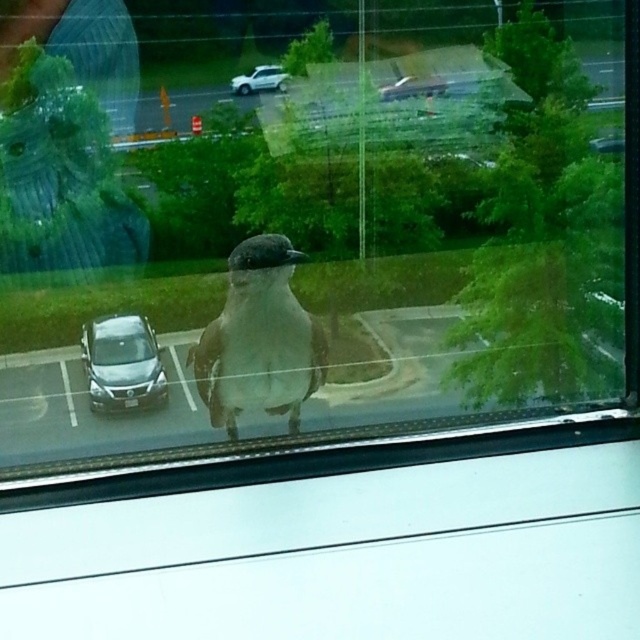
Question: Among these objects, which one is nearest to the camera?

Choices:
 (A) white matte car at center
 (B) satin silver car at lower left
 (C) gray matte bird at center

Answer: (C)

Question: From the image, what is the correct spatial relationship of satin silver car at lower left in relation to white matte car at center?

Choices:
 (A) below
 (B) above

Answer: (A)

Question: Where is satin silver car at lower left located in relation to white matte car at center in the image?

Choices:
 (A) above
 (B) below

Answer: (B)

Question: Does gray matte bird at center lie behind satin silver car at lower left?

Choices:
 (A) no
 (B) yes

Answer: (A)

Question: Which object is closer to the camera taking this photo?

Choices:
 (A) gray matte bird at center
 (B) satin silver car at lower left
 (C) white matte car at center

Answer: (A)

Question: Which point is farther to the camera?

Choices:
 (A) white matte car at center
 (B) satin silver car at lower left
 (C) gray matte bird at center

Answer: (B)